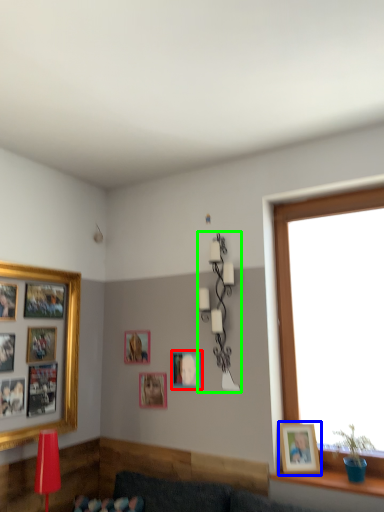
Question: Which object is the closest to the picture frame (highlighted by a red box)? Choose among these: picture frame (highlighted by a blue box) or lamp (highlighted by a green box).

Choices:
 (A) picture frame
 (B) lamp

Answer: (B)